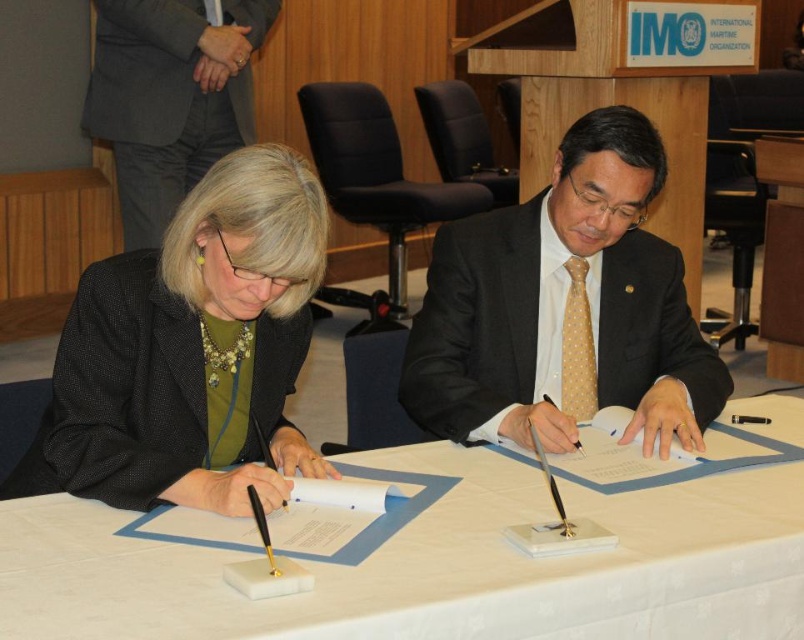
Based on the scene description, can you determine which object is closer to the viewer between the white paper at center and the black fabric jacket at center?

The white paper at center is closer to the viewer since it is in front of the black fabric jacket at center.

You are a photographer adjusting your camera to focus on two points in the image. The first point is at coordinates point (171, 221) and the second is at point (507, 324). Which point should you focus on first if you want to ensure the closest object is in sharp focus?

Point (171, 221) is closer to the camera than point (507, 324), so you should focus on point (171, 221) first to ensure the closest object is in sharp focus.

What are the coordinates of the matte black suit at center?

The coordinates of the matte black suit at center are at point (486, 323).